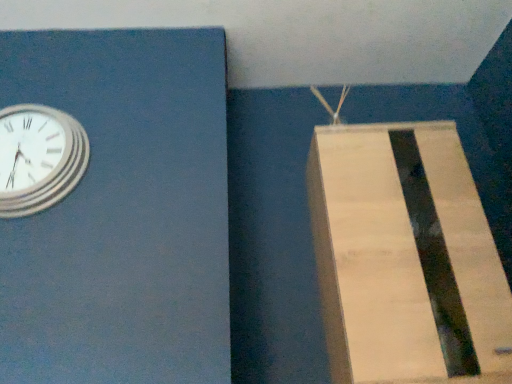
Question: Should I look upward or downward to see light brown cardboard at right?

Choices:
 (A) up
 (B) down

Answer: (B)

Question: Can you confirm if light brown cardboard at right is positioned to the left of silver metallic clock at upper left?

Choices:
 (A) yes
 (B) no

Answer: (B)

Question: Is silver metallic clock at upper left at the back of light brown cardboard at right?

Choices:
 (A) no
 (B) yes

Answer: (A)

Question: From a real-world perspective, is light brown cardboard at right below silver metallic clock at upper left?

Choices:
 (A) no
 (B) yes

Answer: (B)

Question: Is light brown cardboard at right bigger than silver metallic clock at upper left?

Choices:
 (A) yes
 (B) no

Answer: (A)

Question: Does light brown cardboard at right contain silver metallic clock at upper left?

Choices:
 (A) no
 (B) yes

Answer: (A)

Question: Considering the relative positions of light brown cardboard at right and silver metallic clock at upper left in the image provided, is light brown cardboard at right in front of silver metallic clock at upper left?

Choices:
 (A) no
 (B) yes

Answer: (B)

Question: Is silver metallic clock at upper left positioned beyond the bounds of light brown cardboard at right?

Choices:
 (A) no
 (B) yes

Answer: (B)

Question: Is light brown cardboard at right completely or partially inside silver metallic clock at upper left?

Choices:
 (A) yes
 (B) no

Answer: (B)

Question: Is the position of silver metallic clock at upper left less distant than that of light brown cardboard at right?

Choices:
 (A) no
 (B) yes

Answer: (A)

Question: Is silver metallic clock at upper left oriented away from light brown cardboard at right?

Choices:
 (A) no
 (B) yes

Answer: (A)

Question: Does silver metallic clock at upper left come behind light brown cardboard at right?

Choices:
 (A) no
 (B) yes

Answer: (B)

Question: From a real-world perspective, is silver metallic clock at upper left over light brown cardboard at right?

Choices:
 (A) no
 (B) yes

Answer: (B)

Question: Is silver metallic clock at upper left spatially inside light brown cardboard at right, or outside of it?

Choices:
 (A) outside
 (B) inside

Answer: (A)